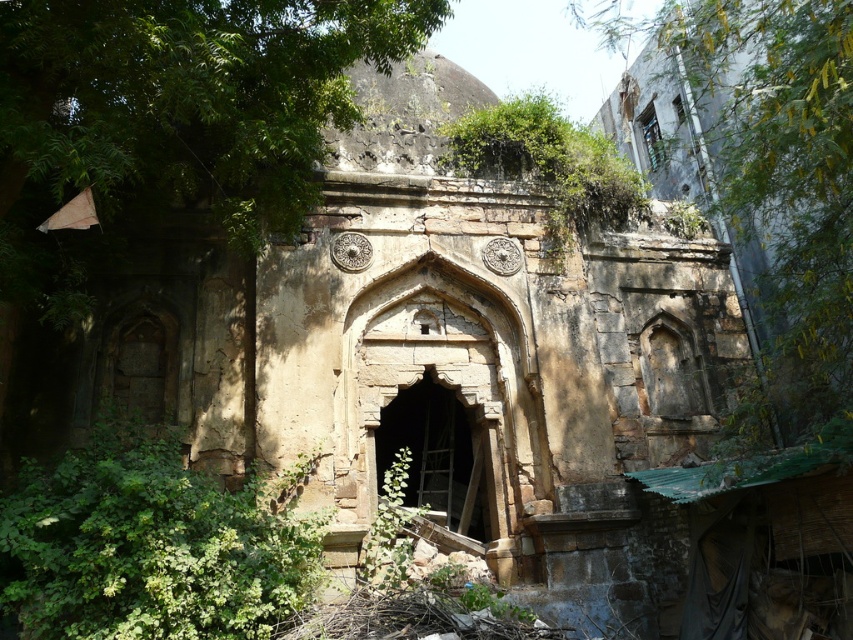
Which of these two, green leafy tree at upper right or green leafy plant at lower left, stands shorter?

green leafy plant at lower left is shorter.

Consider the image. Does green leafy tree at upper right have a smaller size compared to green leafy plant at lower left?

Actually, green leafy tree at upper right might be larger than green leafy plant at lower left.

Measure the distance between green leafy tree at upper right and camera.

green leafy tree at upper right and camera are 106.40 feet apart from each other.

Image resolution: width=853 pixels, height=640 pixels. Identify the location of green leafy tree at upper right. (778, 189).